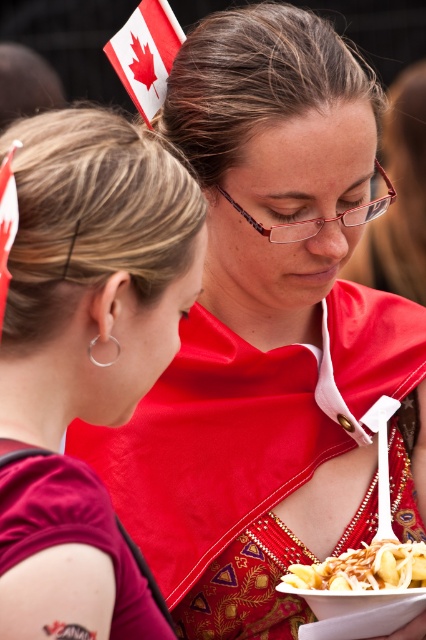
Question: Which object appears farthest from the camera in this image?

Choices:
 (A) red fabric canadian flag at upper left
 (B) golden crispy fries at lower right
 (C) red fabric flag at upper left
 (D) matte red dress at center

Answer: (C)

Question: Which object is the farthest from the red fabric flag at upper left?

Choices:
 (A) golden crispy fries at lower right
 (B) matte red dress at center
 (C) red fabric canadian flag at upper left
 (D) silver metallic earring at left

Answer: (A)

Question: Which point is closer to the camera?

Choices:
 (A) red fabric canadian flag at upper left
 (B) silver metallic earring at left
 (C) red fabric flag at upper left
 (D) matte red dress at center

Answer: (D)

Question: Is matte red dress at center thinner than silver metallic earring at left?

Choices:
 (A) no
 (B) yes

Answer: (A)

Question: Where is red fabric flag at upper left located in relation to golden crispy fries at lower right in the image?

Choices:
 (A) right
 (B) left

Answer: (B)

Question: Is red fabric flag at upper left to the right of red fabric canadian flag at upper left from the viewer's perspective?

Choices:
 (A) yes
 (B) no

Answer: (A)